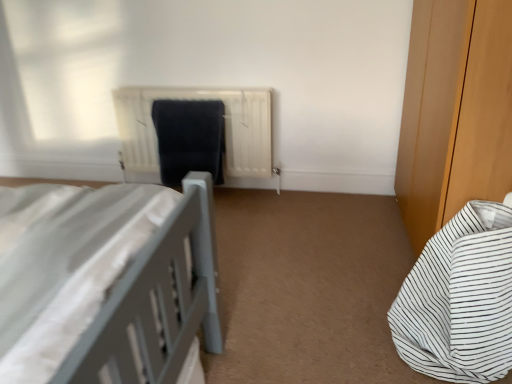
Describe the element at coordinates (225, 128) in the screenshot. This screenshot has height=384, width=512. I see `white matte radiator at center` at that location.

You are a GUI agent. You are given a task and a screenshot of the screen. Output one action in this format:
    pyautogui.click(x=<x>, y=<y>)
    Task: Click on the white striped fabric bed at lower right
    The width and height of the screenshot is (512, 384).
    Given the screenshot: What is the action you would take?
    pyautogui.click(x=460, y=299)

Considering the positions of objects matte black laundry at center and white matte radiator at center in the image provided, who is in front, matte black laundry at center or white matte radiator at center?

matte black laundry at center is more forward.

Could you tell me if matte black laundry at center is turned towards white matte radiator at center?

Yes, matte black laundry at center is turned towards white matte radiator at center.

From a real-world perspective, relative to white matte radiator at center, is matte black laundry at center vertically above or below?

In terms of real-world spatial position, matte black laundry at center is above white matte radiator at center.

Find the location of `radiator above the matte black laundry at center (from the image's perspective)`. radiator above the matte black laundry at center (from the image's perspective) is located at coordinates (225, 128).

From the picture: Is white matte radiator at center bigger than matte black laundry at center?

Correct, white matte radiator at center is larger in size than matte black laundry at center.

The image size is (512, 384). Identify the location of radiator behind the matte black laundry at center. [x=225, y=128].

Are white matte radiator at center and matte black laundry at center far apart?

They are positioned close to each other.

What's the angular difference between white matte radiator at center and matte black laundry at center's facing directions?

0.00381 degrees separate the facing orientations of white matte radiator at center and matte black laundry at center.

Is white striped fabric bed at lower right smaller than white matte radiator at center?

Correct, white striped fabric bed at lower right occupies less space than white matte radiator at center.

In the scene shown: From a real-world perspective, is white striped fabric bed at lower right on top of white matte radiator at center?

No, from a real-world perspective, white striped fabric bed at lower right is not over white matte radiator at center

Is white striped fabric bed at lower right facing away from white matte radiator at center?

No, white striped fabric bed at lower right is not facing away from white matte radiator at center.

From the image's perspective, which object appears higher, white striped fabric bed at lower right or white matte radiator at center?

white matte radiator at center appears higher in the image.

I want to click on bed lying in front of the white matte radiator at center, so click(x=460, y=299).

Is white matte radiator at center next to white striped fabric bed at lower right?

No, white matte radiator at center is not making contact with white striped fabric bed at lower right.

From the image's perspective, is white matte radiator at center beneath white striped fabric bed at lower right?

No, from the image's perspective, white matte radiator at center is not below white striped fabric bed at lower right.

Is white matte radiator at center oriented towards white striped fabric bed at lower right?

No, white matte radiator at center does not turn towards white striped fabric bed at lower right.

Which object is positioned more to the left, white striped fabric bed at lower right or matte black laundry at center?

matte black laundry at center.

In the scene shown: Who is smaller, white striped fabric bed at lower right or matte black laundry at center?

matte black laundry at center.

Is white striped fabric bed at lower right not near matte black laundry at center?

Yes.

What's the angular difference between white striped fabric bed at lower right and matte black laundry at center's facing directions?

There is a 92.4-degree angle between the facing directions of white striped fabric bed at lower right and matte black laundry at center.

Is matte black laundry at center taller or shorter than white striped fabric bed at lower right?

Considering their sizes, matte black laundry at center has less height than white striped fabric bed at lower right.

Locate an element on the screen. laundry that is above the white striped fabric bed at lower right (from a real-world perspective) is located at coordinates (189, 138).

Measure the distance from matte black laundry at center to white striped fabric bed at lower right.

matte black laundry at center and white striped fabric bed at lower right are 1.48 meters apart from each other.

Would you say matte black laundry at center is outside white striped fabric bed at lower right?

Yes, matte black laundry at center is outside of white striped fabric bed at lower right.

I want to click on radiator lying behind the matte black laundry at center, so click(225, 128).

This screenshot has width=512, height=384. What are the coordinates of `radiator lying above the matte black laundry at center (from the image's perspective)` in the screenshot? It's located at (225, 128).

Based on their spatial positions, is matte black laundry at center or white striped fabric bed at lower right further from white matte radiator at center?

white striped fabric bed at lower right is positioned further to the anchor white matte radiator at center.

Based on their spatial positions, is white matte radiator at center or white striped fabric bed at lower right further from matte black laundry at center?

Among the two, white striped fabric bed at lower right is located further to matte black laundry at center.

Based on their spatial positions, is white striped fabric bed at lower right or white matte radiator at center further from matte black laundry at center?

white striped fabric bed at lower right is further to matte black laundry at center.

Which object lies further to the anchor point white matte radiator at center, white striped fabric bed at lower right or matte black laundry at center?

white striped fabric bed at lower right lies further to white matte radiator at center than the other object.

Looking at the image, which one is located further to white striped fabric bed at lower right, white matte radiator at center or matte black laundry at center?

The object further to white striped fabric bed at lower right is matte black laundry at center.

Estimate the real-world distances between objects in this image. Which object is further from white striped fabric bed at lower right, matte black laundry at center or white matte radiator at center?

The object further to white striped fabric bed at lower right is matte black laundry at center.

The width and height of the screenshot is (512, 384). What are the coordinates of `laundry positioned between white striped fabric bed at lower right and white matte radiator at center from near to far` in the screenshot? It's located at (189, 138).